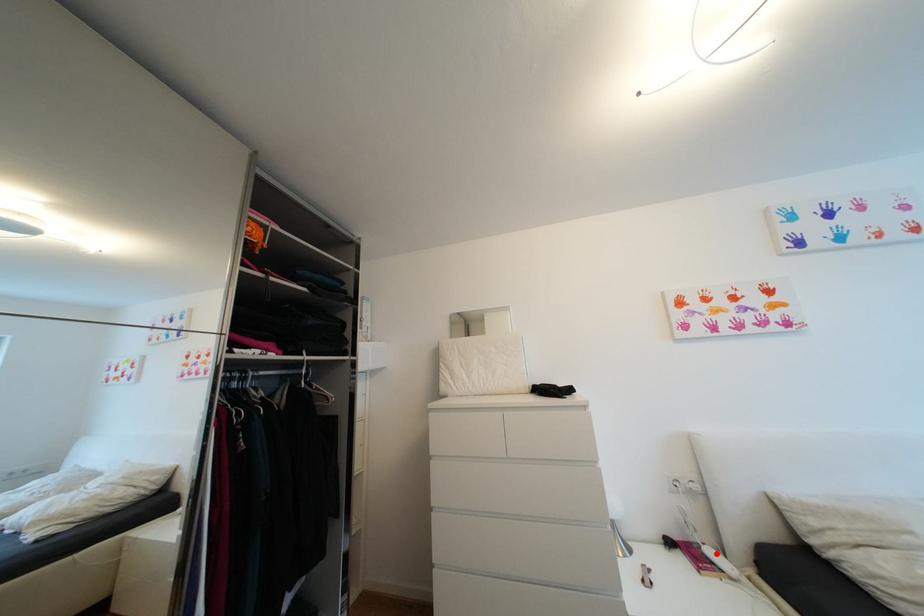
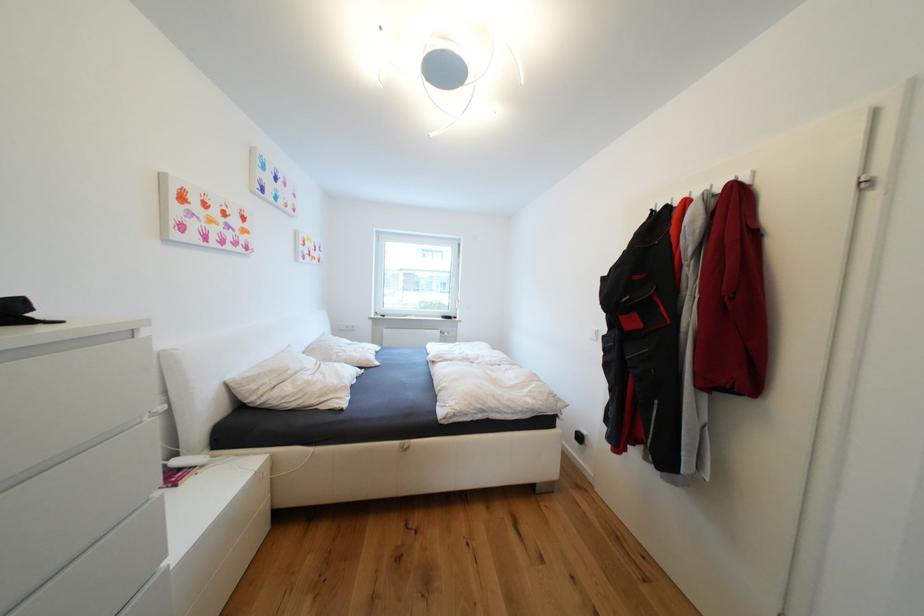
In the second image, find the point that corresponds to the highlighted location in the first image.

(184, 464)